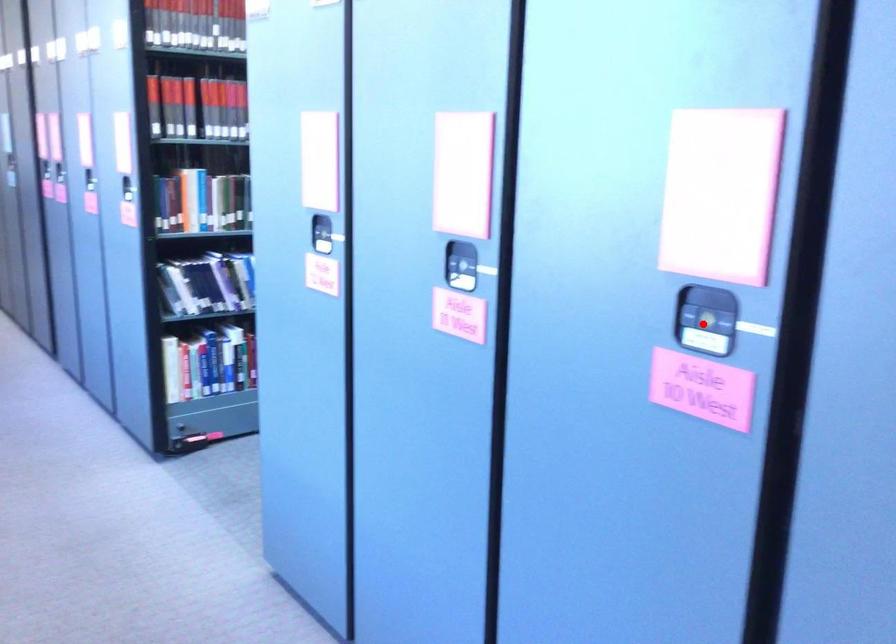
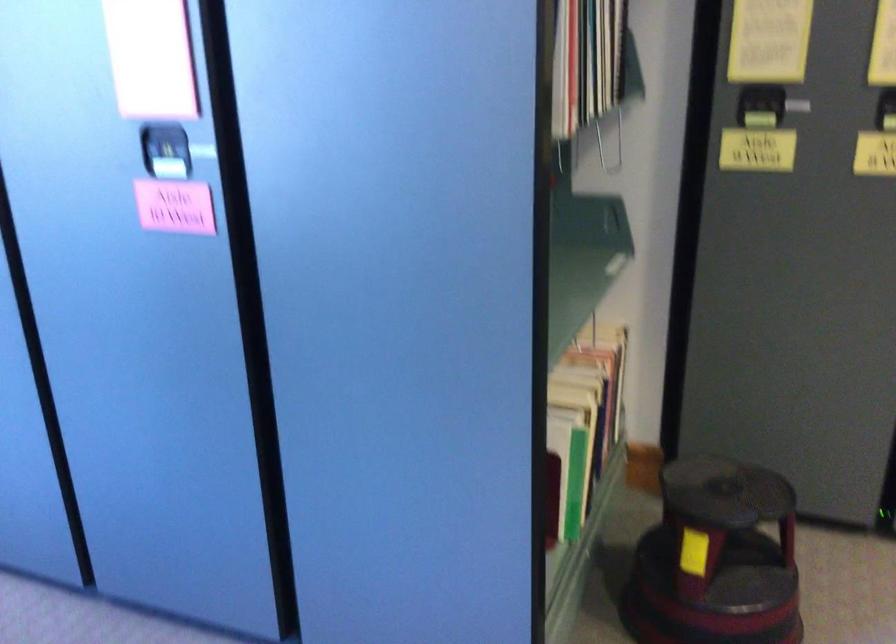
Question: I am providing you with two images of the same scene from different viewpoints. Given a red point in image1, look at the same physical point in image2. Is it:

Choices:
 (A) Closer to the viewpoint
 (B) Farther from the viewpoint

Answer: (B)